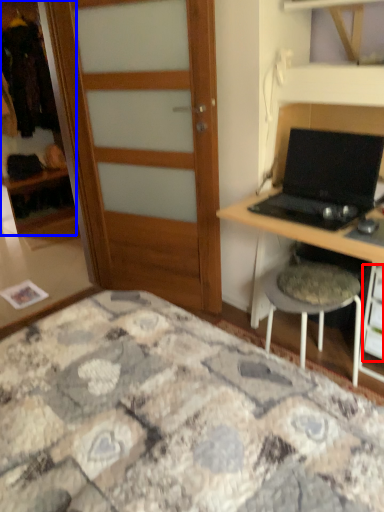
Question: Which object appears closest to the camera in this image, drawer (highlighted by a red box) or cabinetry (highlighted by a blue box)?

Choices:
 (A) drawer
 (B) cabinetry

Answer: (A)